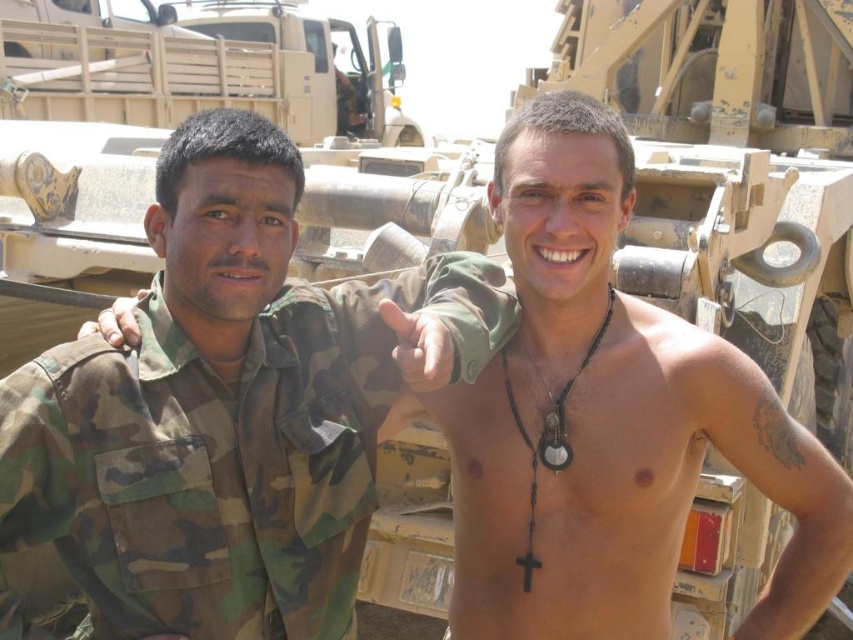
Question: Which object is closer to the camera taking this photo?

Choices:
 (A) camouflage fabric shirt at left
 (B) matte skin hand at center

Answer: (B)

Question: Which of these objects is positioned closest to the camouflage fabric hand at center?

Choices:
 (A) matte skin hand at center
 (B) camouflage fabric shirt at left

Answer: (B)

Question: Does matte skin hand at center appear on the right side of camouflage fabric hand at center?

Choices:
 (A) no
 (B) yes

Answer: (B)

Question: Does camouflage fabric shirt at left appear on the left side of matte skin hand at center?

Choices:
 (A) yes
 (B) no

Answer: (A)

Question: Does camouflage fabric shirt at left appear over matte skin hand at center?

Choices:
 (A) yes
 (B) no

Answer: (B)

Question: Which is farther from the camouflage fabric hand at center?

Choices:
 (A) matte skin hand at center
 (B) camouflage fabric shirt at left

Answer: (A)